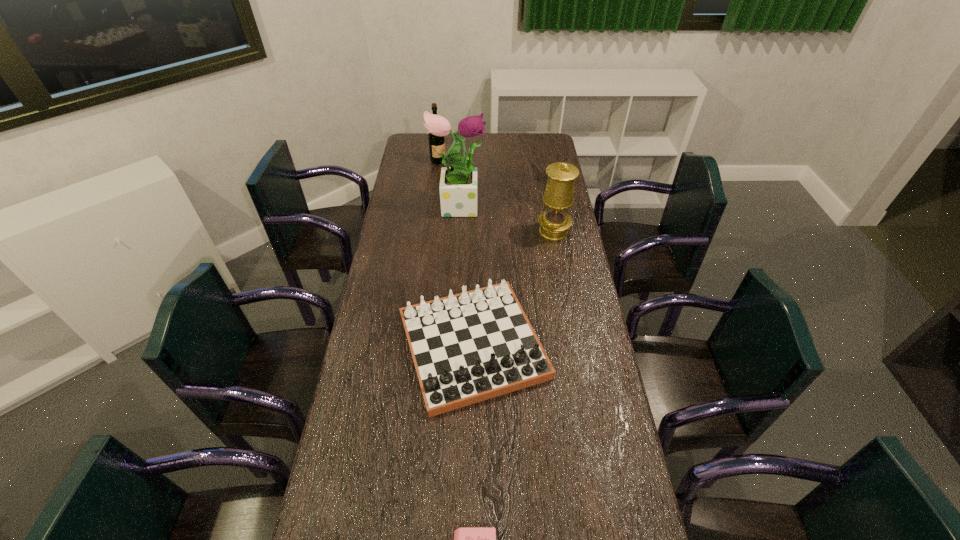
The width and height of the screenshot is (960, 540). Identify the location of free spot that satisfies the following two spatial constraints: 1. on the front-facing side of the gameboard; 2. on the left side of the farthest object. (416, 346).

Locate an element on the screen. This screenshot has height=540, width=960. vacant point that satisfies the following two spatial constraints: 1. on the back side of the third shortest object; 2. on the front-facing side of the farthest object is located at coordinates click(475, 161).

Identify the location of vacant area that satisfies the following two spatial constraints: 1. on the front-facing side of the fourth tallest object; 2. on the right side of the flower arrangement. point(450,346).